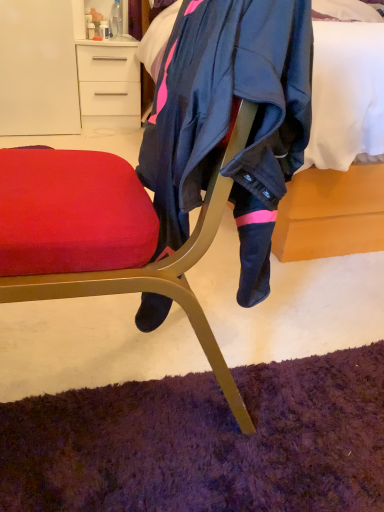
Question: From a real-world perspective, is soft white bed at upper center positioned above or below white glossy drawer at upper left?

Choices:
 (A) above
 (B) below

Answer: (A)

Question: Is soft white bed at upper center in front of or behind white glossy drawer at upper left in the image?

Choices:
 (A) behind
 (B) front

Answer: (B)

Question: Considering the positions of soft white bed at upper center and white glossy drawer at upper left in the image, is soft white bed at upper center taller or shorter than white glossy drawer at upper left?

Choices:
 (A) tall
 (B) short

Answer: (A)

Question: Is white glossy drawer at upper left in front of or behind soft white bed at upper center in the image?

Choices:
 (A) front
 (B) behind

Answer: (B)

Question: From a real-world perspective, relative to soft white bed at upper center, is white glossy drawer at upper left vertically above or below?

Choices:
 (A) below
 (B) above

Answer: (A)

Question: Choose the correct answer: Is white glossy drawer at upper left inside soft white bed at upper center or outside it?

Choices:
 (A) outside
 (B) inside

Answer: (A)

Question: Does point (109, 119) appear closer or farther from the camera than point (281, 256)?

Choices:
 (A) closer
 (B) farther

Answer: (B)